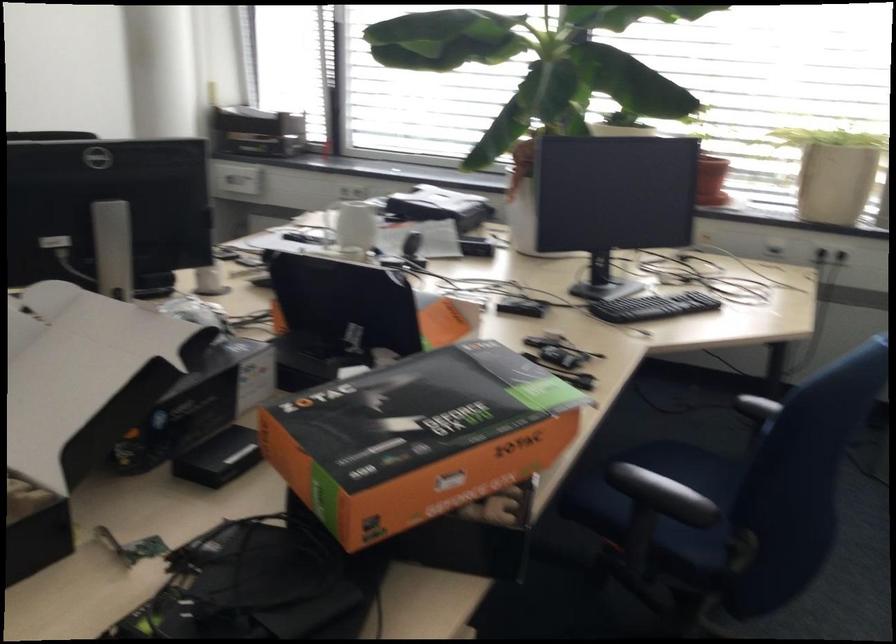
You are a GUI agent. You are given a task and a screenshot of the screen. Output one action in this format:
    pyautogui.click(x=<x>, y=<y>)
    Task: Click on the blue chair sitting surface
    
    Given the screenshot: What is the action you would take?
    pyautogui.click(x=681, y=480)